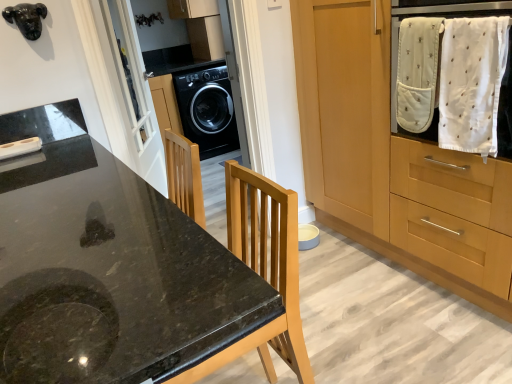
Question: Is white glass screen door at upper left behind black glossy washing machine at center?

Choices:
 (A) no
 (B) yes

Answer: (A)

Question: Would you consider white glass screen door at upper left to be distant from black glossy washing machine at center?

Choices:
 (A) no
 (B) yes

Answer: (B)

Question: Would you say black glossy washing machine at center is part of white glass screen door at upper left's contents?

Choices:
 (A) no
 (B) yes

Answer: (A)

Question: Is white glass screen door at upper left oriented towards black glossy washing machine at center?

Choices:
 (A) no
 (B) yes

Answer: (A)

Question: Is white glass screen door at upper left taller than black glossy washing machine at center?

Choices:
 (A) no
 (B) yes

Answer: (A)

Question: Considering the relative positions of white glass screen door at upper left and black glossy washing machine at center in the image provided, is white glass screen door at upper left to the left of black glossy washing machine at center from the viewer's perspective?

Choices:
 (A) yes
 (B) no

Answer: (A)

Question: Is white cotton towel at upper right in contact with white glass screen door at upper left?

Choices:
 (A) no
 (B) yes

Answer: (A)

Question: Are white cotton towel at upper right and white glass screen door at upper left far apart?

Choices:
 (A) yes
 (B) no

Answer: (A)

Question: Is white cotton towel at upper right positioned with its back to white glass screen door at upper left?

Choices:
 (A) no
 (B) yes

Answer: (A)

Question: Is white cotton towel at upper right positioned in front of white glass screen door at upper left?

Choices:
 (A) yes
 (B) no

Answer: (A)

Question: Is white cotton towel at upper right shorter than white glass screen door at upper left?

Choices:
 (A) no
 (B) yes

Answer: (B)

Question: Is white cotton towel at upper right at the left side of white glass screen door at upper left?

Choices:
 (A) no
 (B) yes

Answer: (A)

Question: From the image's perspective, is black granite countertop at center located above white cotton towel at upper right?

Choices:
 (A) no
 (B) yes

Answer: (A)